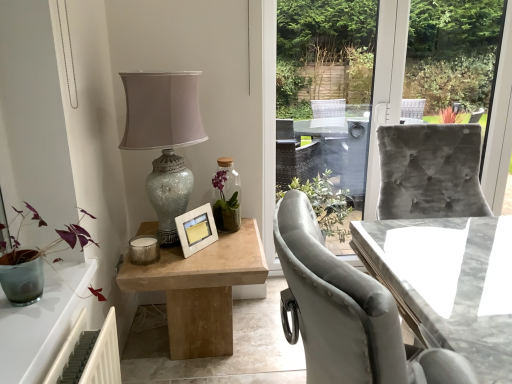
Question: Is purple matte plant at left not near natural wood table at center, positioned as the 2th table in right-to-left order?

Choices:
 (A) no
 (B) yes

Answer: (A)

Question: Can you confirm if purple matte plant at left is positioned to the right of natural wood table at center, arranged as the 1th table when viewed from the left?

Choices:
 (A) yes
 (B) no

Answer: (B)

Question: Does purple matte plant at left have a greater height compared to natural wood table at center, positioned as the 2th table in right-to-left order?

Choices:
 (A) yes
 (B) no

Answer: (B)

Question: Does purple matte plant at left have a smaller size compared to natural wood table at center, arranged as the 1th table when viewed from the left?

Choices:
 (A) no
 (B) yes

Answer: (B)

Question: Considering the relative sizes of purple matte plant at left and natural wood table at center, positioned as the 2th table in right-to-left order, in the image provided, is purple matte plant at left shorter than natural wood table at center, positioned as the 2th table in right-to-left order,?

Choices:
 (A) no
 (B) yes

Answer: (B)

Question: From a real-world perspective, relative to marble table at right, which ranks as the second table in left-to-right order, is white matte picture frame at center vertically above or below?

Choices:
 (A) above
 (B) below

Answer: (A)

Question: From the image's perspective, is white matte picture frame at center above or below marble table at right, which ranks as the second table in left-to-right order?

Choices:
 (A) below
 (B) above

Answer: (B)

Question: Looking at the image, does white matte picture frame at center seem bigger or smaller compared to marble table at right, which ranks as the second table in left-to-right order?

Choices:
 (A) small
 (B) big

Answer: (A)

Question: Is white matte picture frame at center situated inside marble table at right, which ranks as the second table in left-to-right order, or outside?

Choices:
 (A) outside
 (B) inside

Answer: (A)

Question: In the image, is purple matte plant at left on the left side or the right side of natural wood table at center, positioned as the 2th table in right-to-left order?

Choices:
 (A) right
 (B) left

Answer: (B)

Question: Is purple matte plant at left taller or shorter than natural wood table at center, positioned as the 2th table in right-to-left order?

Choices:
 (A) short
 (B) tall

Answer: (A)

Question: From a real-world perspective, relative to natural wood table at center, positioned as the 2th table in right-to-left order, is purple matte plant at left vertically above or below?

Choices:
 (A) above
 (B) below

Answer: (A)

Question: Is point (80, 231) closer or farther from the camera than point (195, 309)?

Choices:
 (A) closer
 (B) farther

Answer: (A)

Question: From a real-world perspective, relative to velvet grey chair at right, is natural wood table at center, positioned as the 2th table in right-to-left order, vertically above or below?

Choices:
 (A) below
 (B) above

Answer: (A)

Question: Is natural wood table at center, arranged as the 1th table when viewed from the left, bigger or smaller than velvet grey chair at right?

Choices:
 (A) small
 (B) big

Answer: (B)